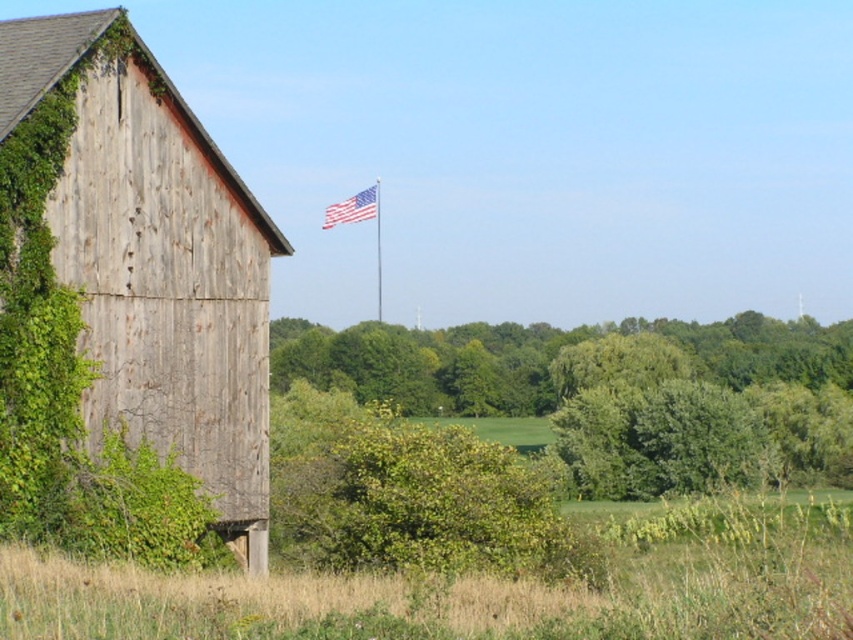
You are a painter planning to paint the weathered wood barn at left and the american flag at upper center. You want to ensure the barn is depicted accurately in proportion to the flag. Based on the scene, which object should you paint larger?

The weathered wood barn at left should be painted larger than the american flag at upper center because it is much taller.

You are a painter planning to paint the weathered wood barn at left and the green leafy tree at center. Which object should you focus on first if you want to paint the taller one first?

The green leafy tree at center is taller than the weathered wood barn at left, so you should focus on painting the green leafy tree at center first.

You are a photographer planning to capture a wide shot of the green leafy tree at center and the american flag at upper center. Your camera can focus on objects up to 25 meters apart. Will both objects be in focus?

The green leafy tree at center and the american flag at upper center are 23.96 meters apart from each other. Since the maximum focus range of the camera is 25 meters, both objects will be within the focus range and thus in focus.